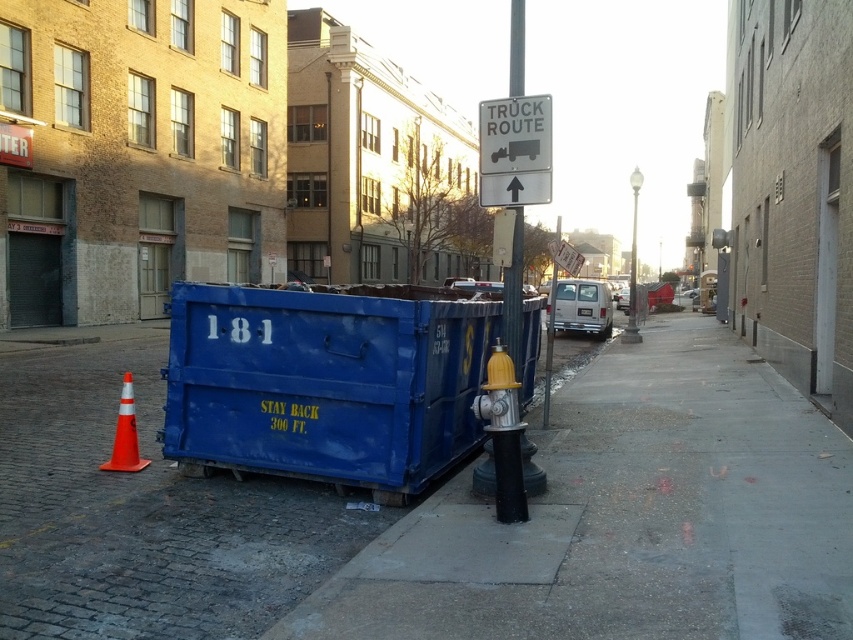
You are a delivery person who needs to place a 5 meter long package between the white plastic sign at upper center and the orange reflective cone at lower left. Can you fit it there?

The distance between the white plastic sign at upper center and the orange reflective cone at lower left is 7.01 meters, so yes, the 5 meter long package can fit between them since it is shorter than the available space.

You are a delivery person trying to navigate through the urban street scene. You need to place a package on the gray concrete sidewalk at lower center. From the perspective of the metallic pole at center, which direction should you move to reach the sidewalk?

The gray concrete sidewalk at lower center is to the right of the metallic pole at center. Therefore, you should move to the right of the metallic pole at center to reach the gray concrete sidewalk at lower center.

You are a delivery driver who needs to park your truck near the orange reflective cone at lower left. There is a white plastic sign at upper center that you must not block. Can you park your truck without blocking the sign?

The white plastic sign at upper center is located above the orange reflective cone at lower left. Since the sign is above the cone, parking near the cone won